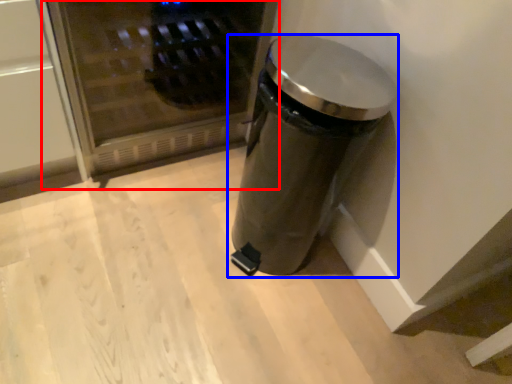
Question: Which of the following is the farthest to the observer, microwave (highlighted by a red box) or waste container (highlighted by a blue box)?

Choices:
 (A) microwave
 (B) waste container

Answer: (A)